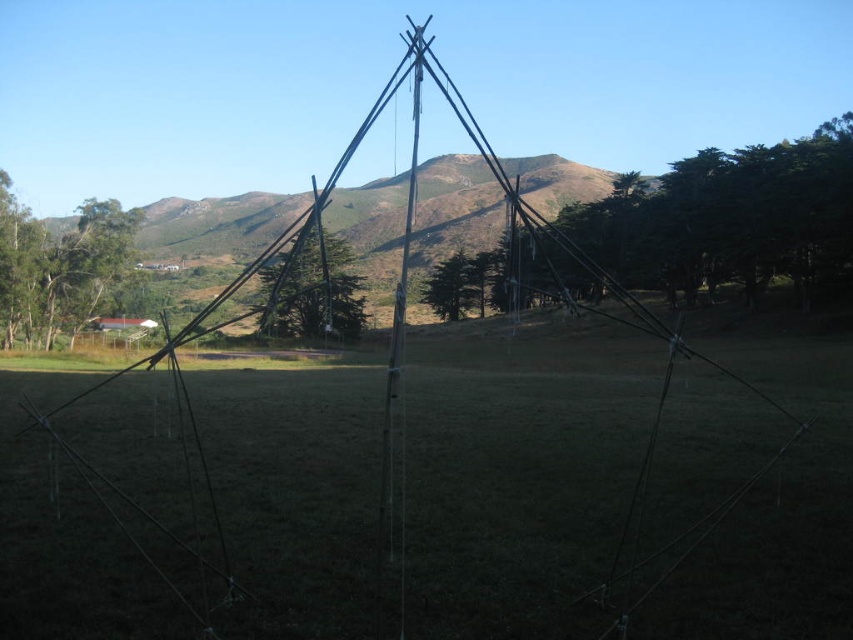
You are planning to set up a picnic area between the green leafy tree at center and the green matte tree at center. Which tree should you choose to place your picnic blanket closer to if you want more shade?

The green leafy tree at center is bigger than the green matte tree at center, so placing the picnic blanket closer to the green leafy tree at center would provide more shade.

You are standing at the base of the geometric structure in the image. Looking towards the center of the scene, what object is located at the coordinates point (730, 220)?

The point (730, 220) indicates a green leafy tree at center.